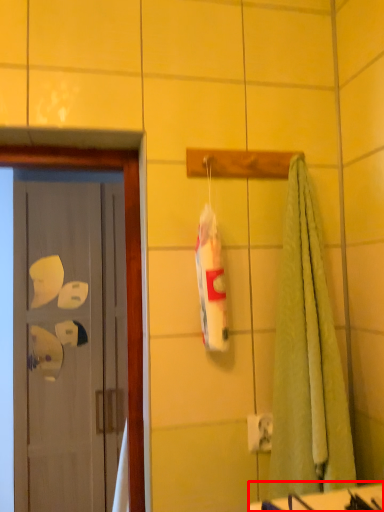
Question: From the image's perspective, what is the correct spatial relationship of counter top (annotated by the red box) in relation to door?

Choices:
 (A) above
 (B) below

Answer: (A)